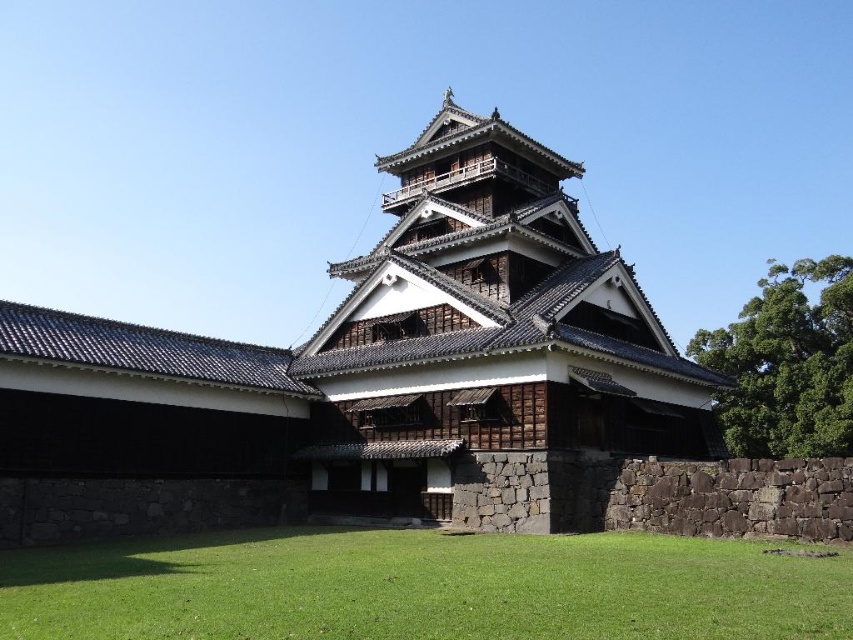
Question: Where is dark brown wood at center located in relation to green grass at lower center in the image?

Choices:
 (A) above
 (B) below

Answer: (A)

Question: Which point is farther to the camera?

Choices:
 (A) dark brown wood at center
 (B) green grass at lower center

Answer: (A)

Question: Does dark brown wood at center come behind green grass at lower center?

Choices:
 (A) yes
 (B) no

Answer: (A)

Question: Which object appears closest to the camera in this image?

Choices:
 (A) dark brown wood at center
 (B) green grass at lower center

Answer: (B)

Question: Is dark brown wood at center behind green grass at lower center?

Choices:
 (A) no
 (B) yes

Answer: (B)